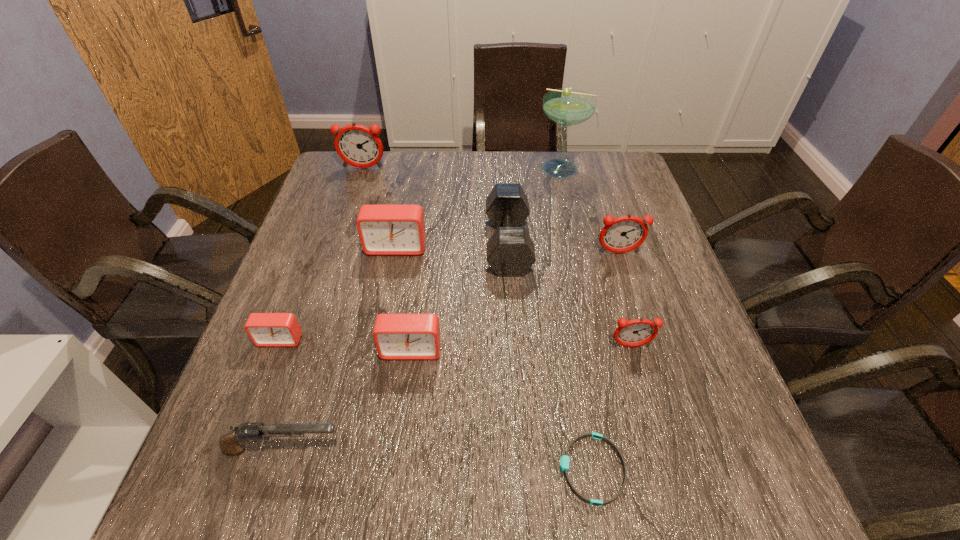
At what (x,y) coordinates should I click in order to perform the action: click on green martini. Please return your answer as a coordinate pair (x, y). Image resolution: width=960 pixels, height=540 pixels. Looking at the image, I should click on (566, 106).

The width and height of the screenshot is (960, 540). Find the location of `the tallest object`. the tallest object is located at coordinates (566, 106).

The width and height of the screenshot is (960, 540). Find the location of `the farthest reddish-pink alarm clock`. the farthest reddish-pink alarm clock is located at coordinates (358, 146).

Identify the location of the farthest alarm clock. The image size is (960, 540). (358, 146).

Image resolution: width=960 pixels, height=540 pixels. In order to click on the second farthest reddish-pink alarm clock in this screenshot , I will do `click(626, 233)`.

At what (x,y) coordinates should I click in order to perform the action: click on the farthest red alarm clock. Please return your answer as a coordinate pair (x, y). This screenshot has width=960, height=540. Looking at the image, I should click on (383, 229).

Identify the location of dumbbell. The width and height of the screenshot is (960, 540). (510, 251).

Where is `the second biggest red alarm clock`? This screenshot has height=540, width=960. the second biggest red alarm clock is located at coordinates (397, 336).

Where is `the smallest reddish-pink alarm clock`? The image size is (960, 540). the smallest reddish-pink alarm clock is located at coordinates (x=637, y=332).

Identify the location of gun. The height and width of the screenshot is (540, 960). (230, 443).